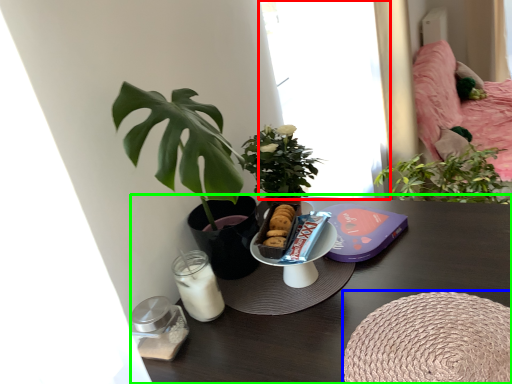
Question: Which object is the closest to the window (highlighted by a red box)? Choose among these: round table (highlighted by a blue box) or table (highlighted by a green box).

Choices:
 (A) round table
 (B) table

Answer: (B)